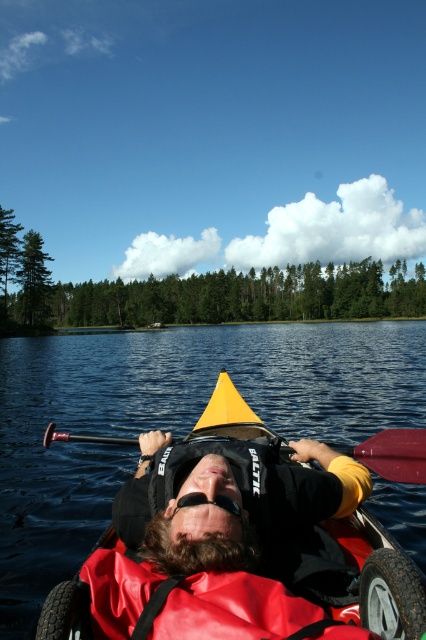
Question: Does red plastic paddle at center appear on the left side of black rubber goggles at center?

Choices:
 (A) yes
 (B) no

Answer: (A)

Question: Estimate the real-world distances between objects in this image. Which object is farther from the transparent water at center?

Choices:
 (A) black matte life vest at center
 (B) black rubber goggles at center

Answer: (B)

Question: Which point appears closest to the camera in this image?

Choices:
 (A) coord(267,483)
 (B) coord(226,502)

Answer: (B)

Question: Which object is closer to the camera taking this photo?

Choices:
 (A) black matte life vest at center
 (B) black rubber goggles at center

Answer: (A)

Question: Can you confirm if transparent water at center is positioned to the left of black matte life vest at center?

Choices:
 (A) no
 (B) yes

Answer: (A)

Question: Can you confirm if transparent water at center is wider than red plastic paddle at center?

Choices:
 (A) no
 (B) yes

Answer: (B)